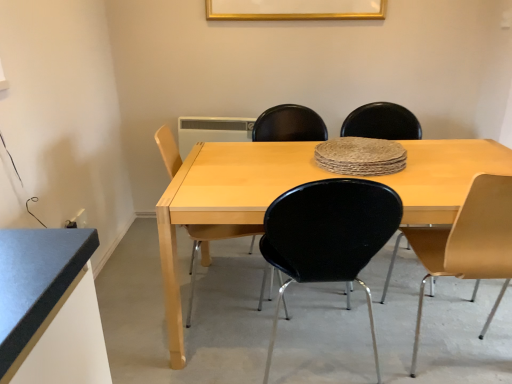
Question: Based on their sizes in the image, would you say matte yellow chair at right, placed as the first chair when sorted from right to left, is bigger or smaller than light wood/black plastic chair at center, the 1th chair when ordered from left to right?

Choices:
 (A) big
 (B) small

Answer: (A)

Question: In the image, is matte yellow chair at right, placed as the first chair when sorted from right to left, positioned in front of or behind light wood/black plastic chair at center, which is the 4th chair from right to left?

Choices:
 (A) behind
 (B) front

Answer: (B)

Question: Considering the real-world distances, which object is farthest from the light wood/black plastic chair at center, the 1th chair when ordered from left to right?

Choices:
 (A) matte yellow chair at right, which appears as the 4th chair when viewed from the left
 (B) glossy black chair at center, which is the 2th chair from left to right
 (C) white plastic radiator at upper center
 (D) light wood table at center
 (E) gold metallic picture frame at upper center

Answer: (E)

Question: Which object is the farthest from the white plastic radiator at upper center?

Choices:
 (A) gold metallic picture frame at upper center
 (B) matte yellow chair at right, which appears as the 4th chair when viewed from the left
 (C) light wood table at center
 (D) glossy black chair at center, which is the 2th chair from left to right
 (E) matte black chair at center, placed as the second chair when sorted from right to left

Answer: (B)